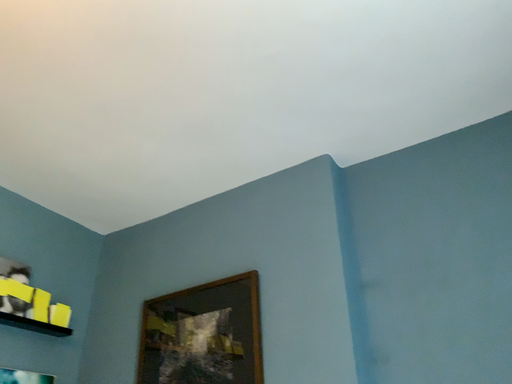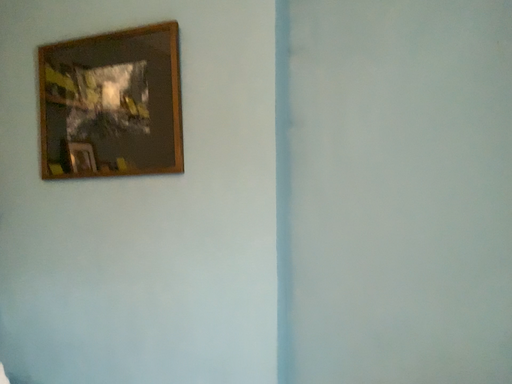
Question: How did the camera likely rotate when shooting the video?

Choices:
 (A) rotated downward
 (B) rotated upward

Answer: (A)